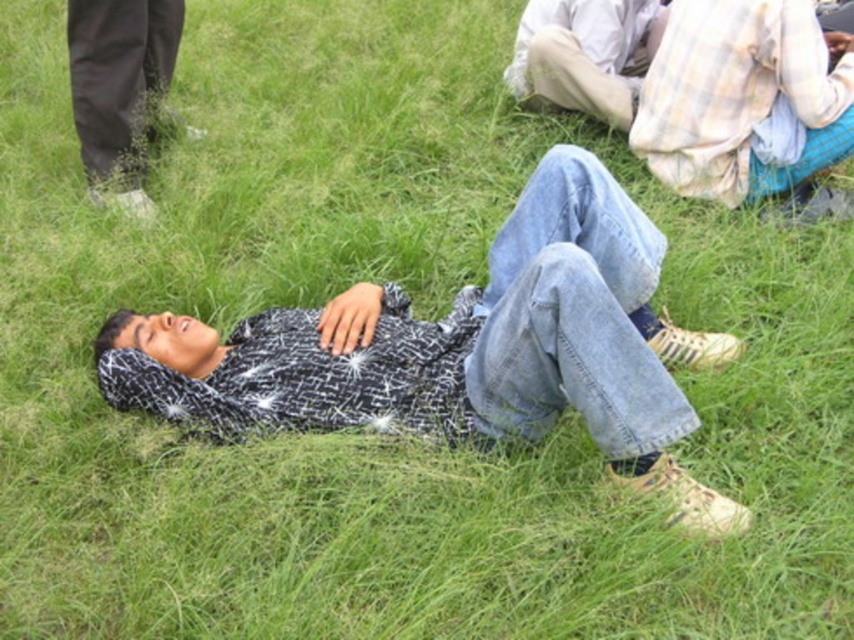
Consider the image. Can you confirm if denim at lower center is positioned below light beige cotton pants at upper right?

Yes, denim at lower center is below light beige cotton pants at upper right.

Which is behind, point (592, 429) or point (623, 96)?

Point (623, 96)

What are the coordinates of `denim at lower center` in the screenshot? It's located at (572, 316).

Between denim at lower center and black matte pants at upper left, which one is positioned lower?

denim at lower center is below.

Can you confirm if denim at lower center is smaller than black matte pants at upper left?

Incorrect, denim at lower center is not smaller in size than black matte pants at upper left.

Does point (629, 352) come farther from viewer compared to point (151, 134)?

No, it is not.

Where is `denim at lower center`? denim at lower center is located at coordinates pyautogui.click(x=572, y=316).

Consider the image. Does plaid fabric shirt at upper right lie behind black matte pants at upper left?

No.

Between plaid fabric shirt at upper right and black matte pants at upper left, which one has less height?

plaid fabric shirt at upper right

Is point (746, 1) less distant than point (124, 92)?

Yes, point (746, 1) is closer to viewer.

Locate an element on the screen. This screenshot has width=854, height=640. plaid fabric shirt at upper right is located at coordinates (743, 99).